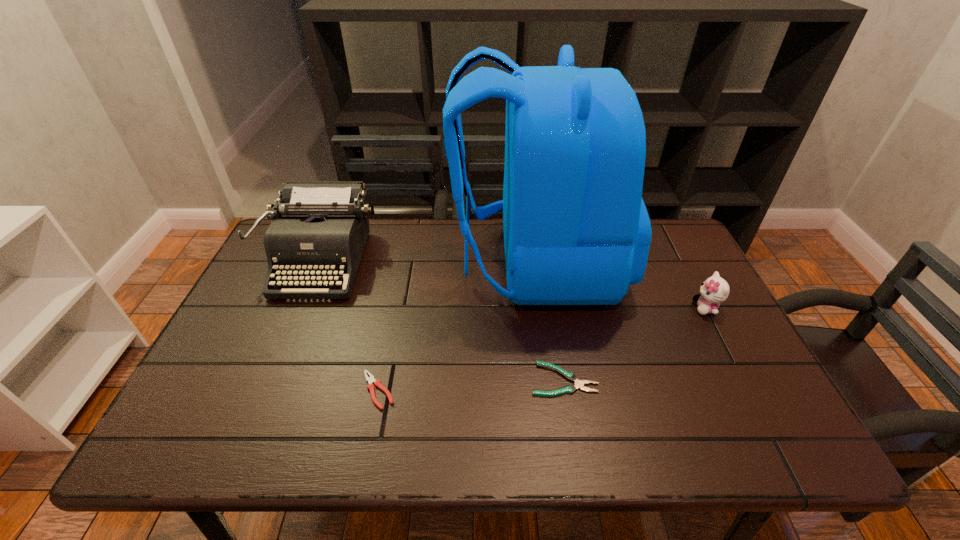
Where is `object present at the far left corner`? object present at the far left corner is located at coordinates (319, 229).

You are a GUI agent. You are given a task and a screenshot of the screen. Output one action in this format:
    pyautogui.click(x=<x>, y=<y>)
    Task: Click on the free spot at the near edge of the desktop
    
    Given the screenshot: What is the action you would take?
    pyautogui.click(x=409, y=441)

At what (x,y) coordinates should I click in order to perform the action: click on vacant space at the left edge of the desktop. Please return your answer as a coordinate pair (x, y). The width and height of the screenshot is (960, 540). Looking at the image, I should click on (235, 314).

Image resolution: width=960 pixels, height=540 pixels. In the image, there is a desktop. Find the location of `vacant space at the right edge`. vacant space at the right edge is located at coordinates (648, 266).

Identify the location of free space at the far right corner of the desktop. The height and width of the screenshot is (540, 960). (688, 264).

The width and height of the screenshot is (960, 540). What are the coordinates of `vacant space at the near right corner of the desktop` in the screenshot? It's located at (794, 443).

Locate an element on the screen. free space between the second tallest object and the left pliers is located at coordinates (349, 325).

You are a GUI agent. You are given a task and a screenshot of the screen. Output one action in this format:
    pyautogui.click(x=<x>, y=<y>)
    Task: Click on the blank region between the backpack and the right pliers
    The height and width of the screenshot is (540, 960).
    Given the screenshot: What is the action you would take?
    pyautogui.click(x=550, y=321)

This screenshot has height=540, width=960. I want to click on vacant space that's between the tallest object and the left pliers, so point(458,327).

This screenshot has height=540, width=960. I want to click on blank region between the second object from left to right and the kitten, so click(x=542, y=349).